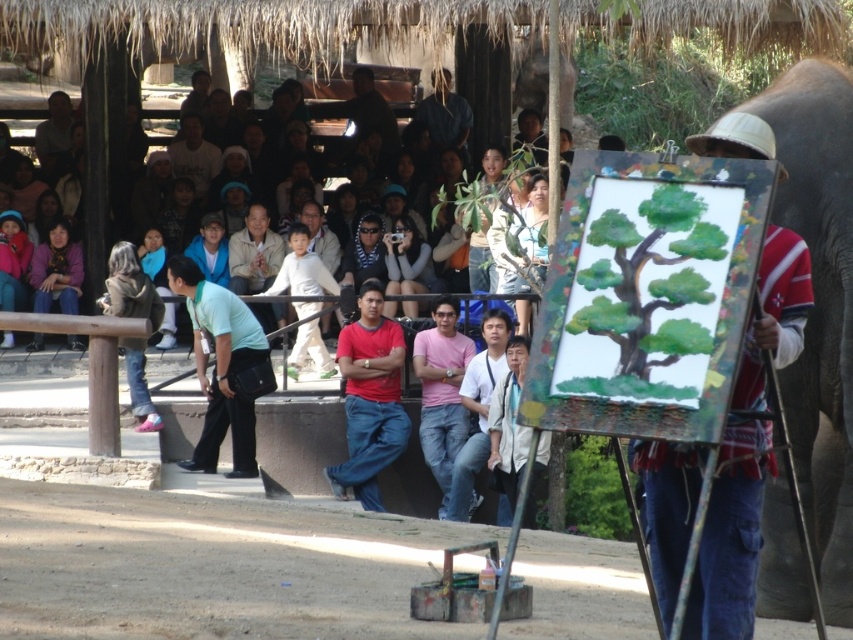
You are a photographer trying to capture the entire scene of the artist and the audience. However, your camera has a limited field of view. Given that the gray textured elephant at right is smaller in size compared to the matte black clothing at upper left, which object should you prioritize framing closer to avoid cropping?

Since the gray textured elephant at right is smaller than the matte black clothing at upper left, you should prioritize framing closer to the matte black clothing at upper left to ensure it fits within the camera frame without cropping.

You are standing at point (566, 90) and want to walk to the artist painting the tree. Is there a clear path from your current position to the artist without passing through point (199, 438)?

Point (199, 438) is in front of point (566, 90). Since you are at point (566, 90) and want to reach the artist, you would need to go around point (199, 438) as it is blocking your direct path.

You are a photographer positioned behind the artist and want to capture both the matte black shirt at center and the light brown shirt at upper left in your shot. Which person should you focus on first to ensure they are in frame before adjusting your camera settings?

You should focus on the matte black shirt at center first because it has a smaller width than the light brown shirt at upper left, making it easier to frame initially.